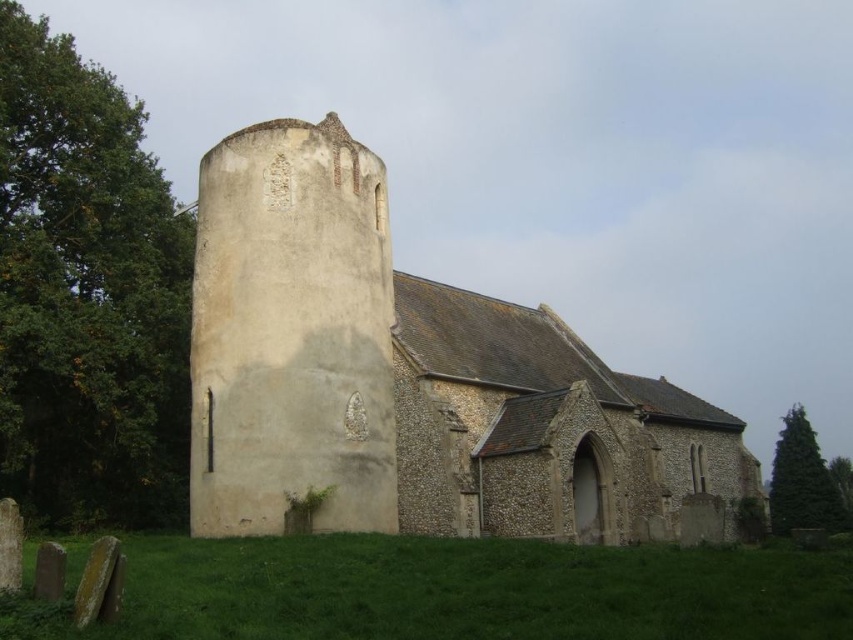
You are a photographer standing at the edge of the green grass at lower center, aiming to capture the beige stone church at center in your shot. Considering the height difference between them, will the church appear taller than the grass in your photo?

Yes, the beige stone church at center has a greater height compared to the green grass at lower center, so it will appear taller in the photo.

You are standing on the green grass at lower center and want to walk towards the beige stone church at center. In which direction should you head?

The beige stone church at center is positioned on the right side of green grass at lower center, so you should head to the right to reach it.

You are standing on the green grass at lower center in front of the beige stone church at center. If you look up, what structure will you see above you?

The beige stone church at center is located above the green grass at lower center, so when you look up, you will see the beige stone church at center above you.